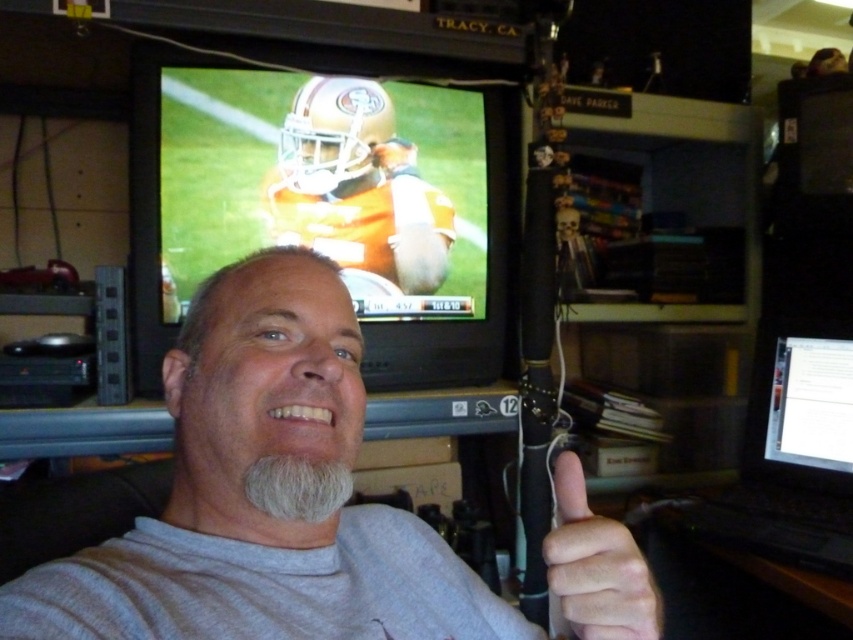
Question: Which object is farther from the camera taking this photo?

Choices:
 (A) gray matte shirt at center
 (B) skinny white hand at lower right

Answer: (B)

Question: Does orange glossy tv at upper center have a greater width compared to skinny white hand at lower right?

Choices:
 (A) no
 (B) yes

Answer: (B)

Question: Observing the image, what is the correct spatial positioning of black plastic laptop at right in reference to skinny white hand at lower right?

Choices:
 (A) above
 (B) below

Answer: (B)

Question: Is orange glossy tv at upper center to the left of graywoollybeard at center from the viewer's perspective?

Choices:
 (A) yes
 (B) no

Answer: (A)

Question: Which object is closer to the camera taking this photo?

Choices:
 (A) graywoollybeard at center
 (B) skinny white hand at lower right
 (C) gray matte shirt at center
 (D) black plastic laptop at right

Answer: (C)

Question: Which point is closer to the camera taking this photo?

Choices:
 (A) (834, 493)
 (B) (296, 458)
 (C) (310, 202)
 (D) (601, 592)

Answer: (D)